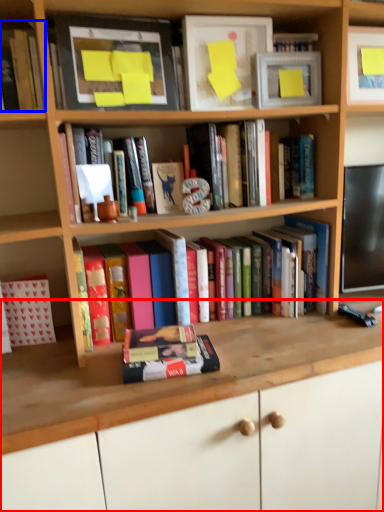
Question: Which of the following is the farthest to the observer, computer desk (highlighted by a red box) or book (highlighted by a blue box)?

Choices:
 (A) computer desk
 (B) book

Answer: (B)